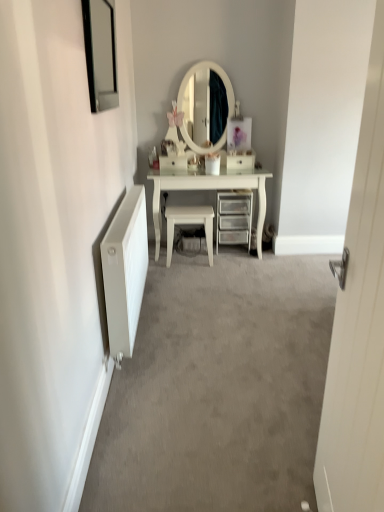
Identify the location of free space in front of white matte radiator at left. (179, 393).